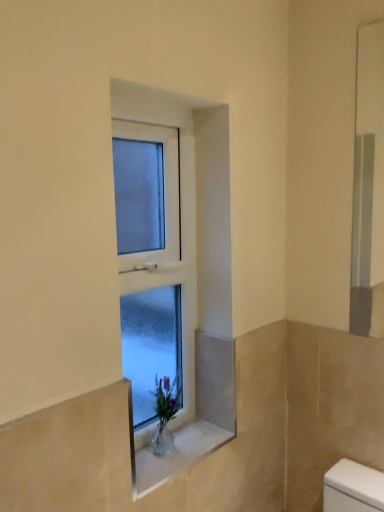
Question: From a real-world perspective, is clear glass vase at center positioned above or below white frosted glass window at center?

Choices:
 (A) above
 (B) below

Answer: (B)

Question: Is clear glass vase at center wider or thinner than white frosted glass window at center?

Choices:
 (A) wide
 (B) thin

Answer: (A)

Question: Looking at the image, does clear glass vase at center seem bigger or smaller compared to white frosted glass window at center?

Choices:
 (A) small
 (B) big

Answer: (A)

Question: Is white frosted glass window at center wider or thinner than clear glass vase at center?

Choices:
 (A) thin
 (B) wide

Answer: (A)

Question: Is white frosted glass window at center spatially inside clear glass vase at center, or outside of it?

Choices:
 (A) outside
 (B) inside

Answer: (A)

Question: From the image's perspective, is white frosted glass window at center positioned above or below clear glass vase at center?

Choices:
 (A) below
 (B) above

Answer: (B)

Question: Is white frosted glass window at center taller or shorter than clear glass vase at center?

Choices:
 (A) short
 (B) tall

Answer: (B)